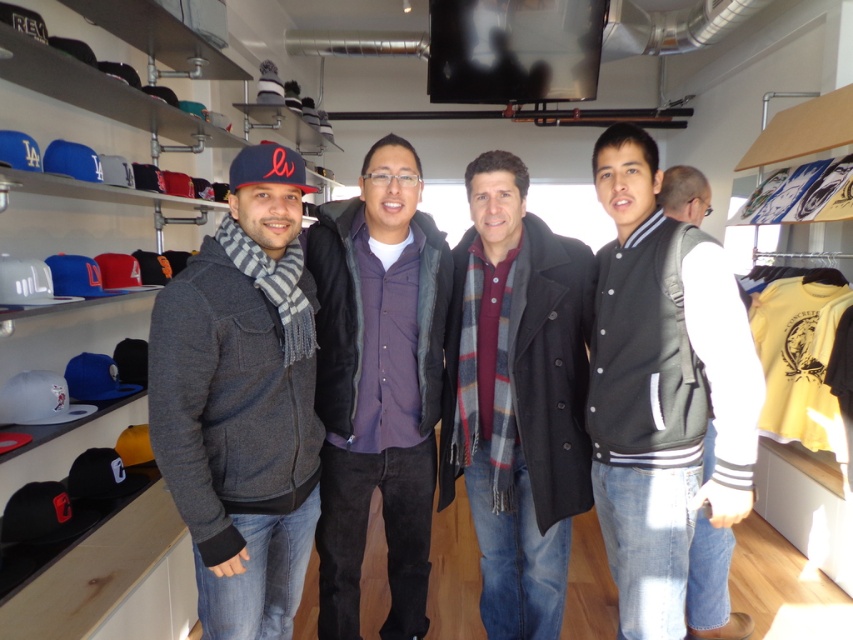
You are standing in the sports apparel store and want to move from the entrance to the exit. The entrance is near point (26,593) and the exit is near point (511,388). According to the scene, which direction should you walk to reach the exit?

Since point (26,593) is behind point (511,388), you should walk forward towards point (511,388) to reach the exit.

You are trying to decide which item to grab first from the store shelf. The matte black cap at left and the plaid scarf at center are both in your line of sight. Based on their heights, which one can you reach without needing to stand on your toes?

The matte black cap at left has a lesser height compared to the plaid scarf at center, so you can reach the matte black cap at left without needing to stand on your toes.

You are a customer in a sports store and see two caps, the matte black cap at left and the matte blue baseball cap at left. Which one is bigger in size?

The matte black cap at left is larger in size compared to the matte blue baseball cap at left.